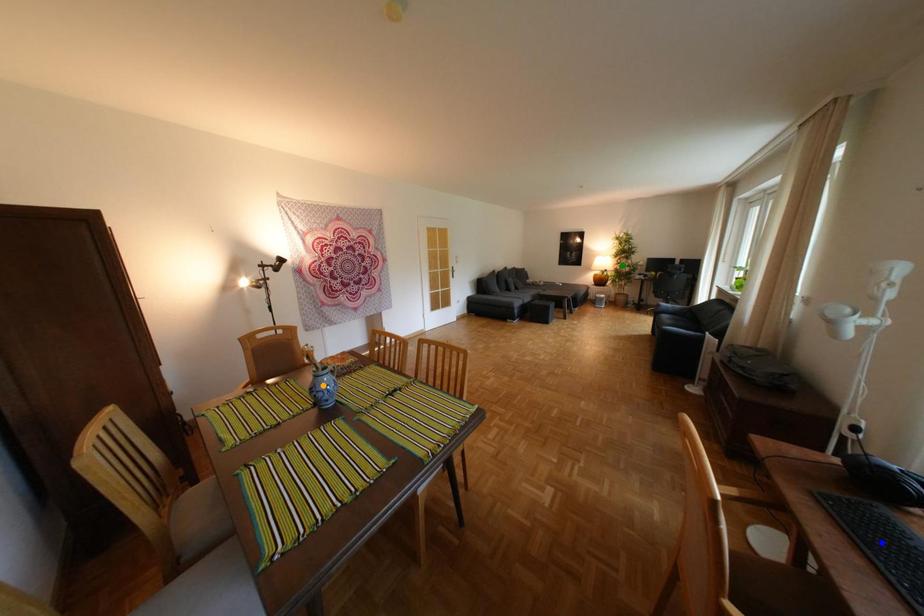
Order these from nearest to farthest:
orange point | green point | blue point

green point, orange point, blue point